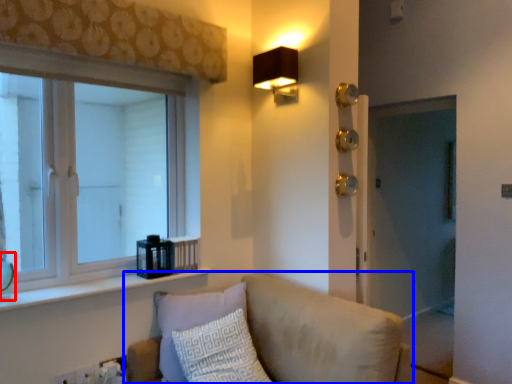
Question: Which object is closer to the camera taking this photo, glass vase (highlighted by a red box) or studio couch (highlighted by a blue box)?

Choices:
 (A) glass vase
 (B) studio couch

Answer: (B)